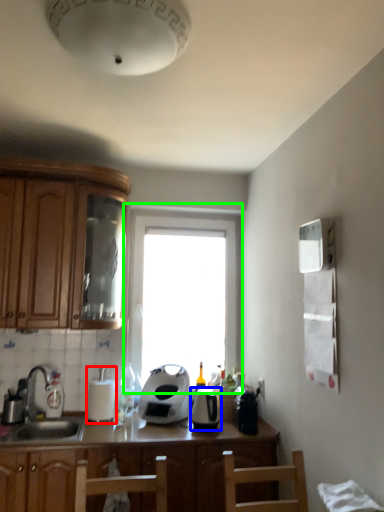
Question: Considering the real-world distances, which object is closest to appliance (highlighted by a red box)? kitchen appliance (highlighted by a blue box) or window (highlighted by a green box).

Choices:
 (A) kitchen appliance
 (B) window

Answer: (A)